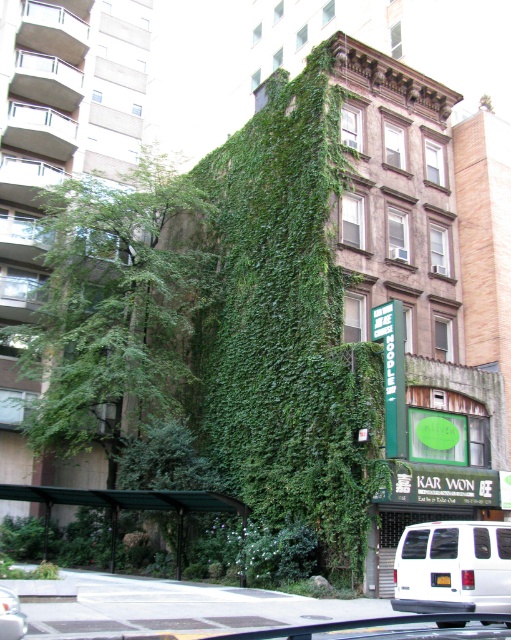
Question: Does green leafy ivy at center have a greater width compared to green leafy tree at left?

Choices:
 (A) yes
 (B) no

Answer: (B)

Question: Which of the following is the farthest from the observer?

Choices:
 (A) white matte van at lower left
 (B) white matte van at lower right

Answer: (B)

Question: Which of the following is the closest to the observer?

Choices:
 (A) green leafy ivy at center
 (B) white matte van at lower left
 (C) white matte van at lower right
 (D) green leafy tree at left

Answer: (B)

Question: Is green leafy tree at left closer to camera compared to white matte van at lower right?

Choices:
 (A) no
 (B) yes

Answer: (A)

Question: Is green leafy tree at left to the right of white matte van at lower left from the viewer's perspective?

Choices:
 (A) no
 (B) yes

Answer: (A)

Question: Which point is farther to the camera?

Choices:
 (A) green leafy ivy at center
 (B) white matte van at lower right
 (C) green leafy tree at left

Answer: (C)